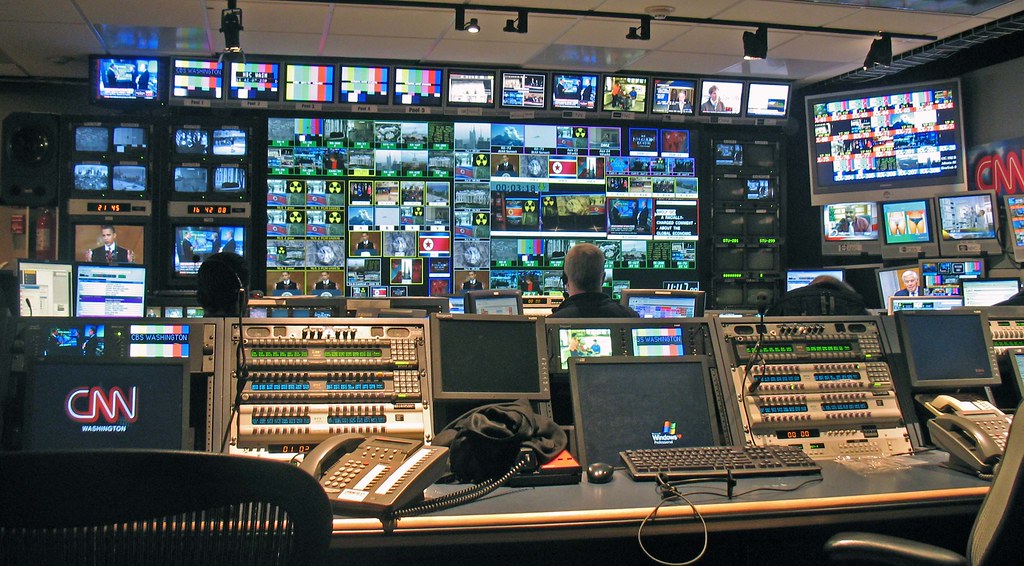
The image size is (1024, 566). In order to click on light fixtures in this screenshot , I will do `click(232, 38)`, `click(511, 25)`, `click(467, 25)`, `click(640, 35)`, `click(754, 54)`, `click(889, 55)`.